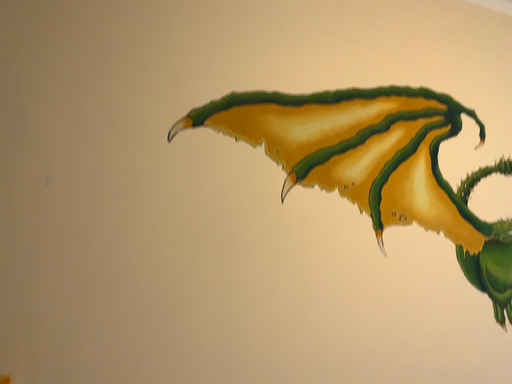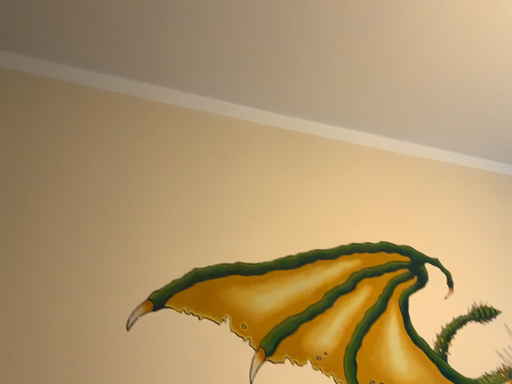
Question: Which way did the camera rotate in the video?

Choices:
 (A) rotated downward
 (B) rotated upward

Answer: (B)